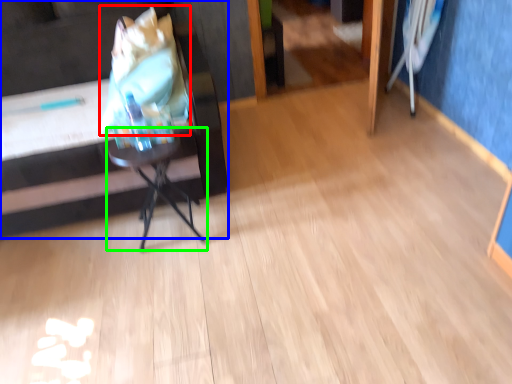
Question: Which object is positioned closest to grocery bag (highlighted by a red box)? Select from furniture (highlighted by a blue box) and table (highlighted by a green box).

Choices:
 (A) furniture
 (B) table

Answer: (A)